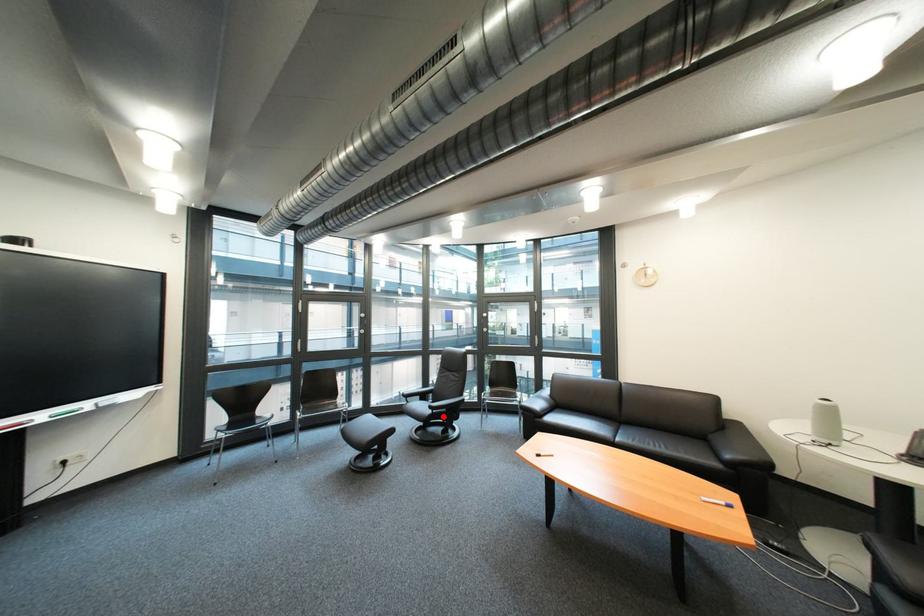
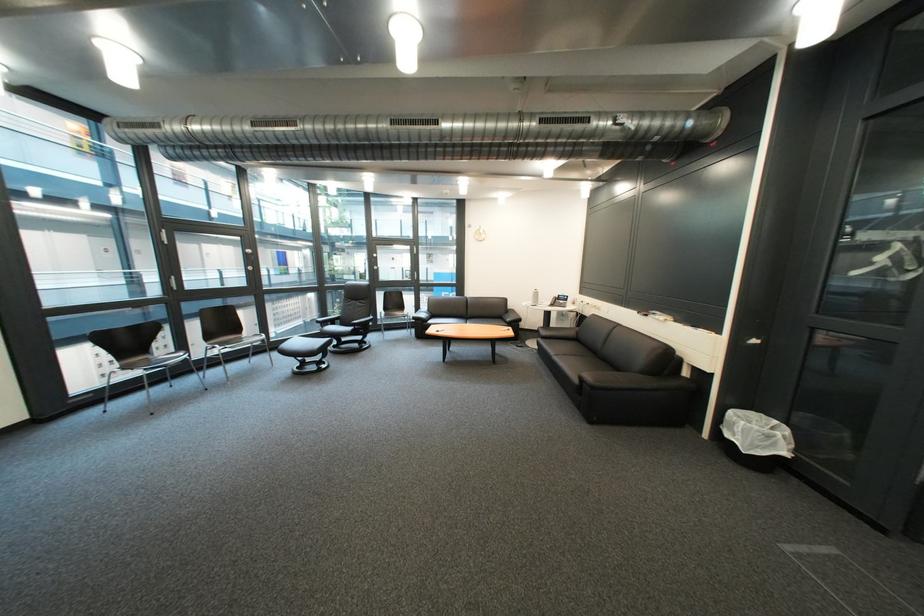
Question: I am providing you with two images of the same scene from different viewpoints. Image1 has a red point marked. In image2, the corresponding 3D location appears at what relative position? Reply with the corresponding letter.

Choices:
 (A) Closer
 (B) Farther

Answer: (A)